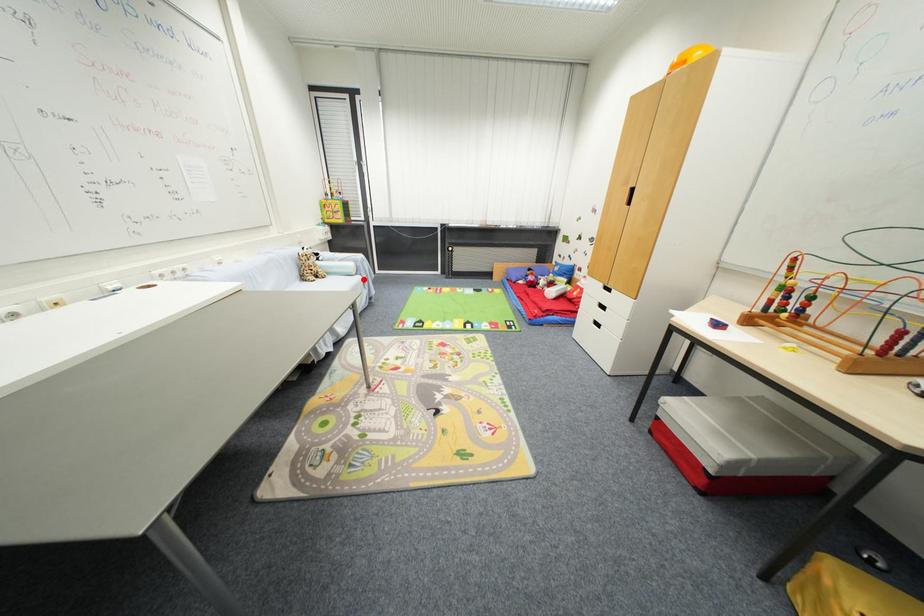
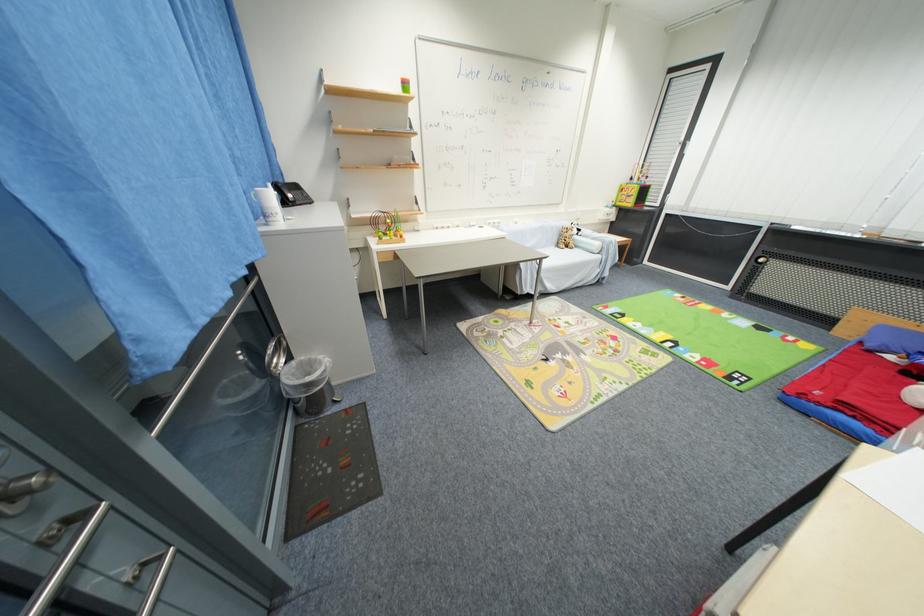
Question: I am providing you with two images of the same scene from different viewpoints. Image1 has a red point marked. In image2, the corresponding 3D location appears at what relative position? Reply with the corresponding letter.

Choices:
 (A) Closer
 (B) Farther

Answer: (B)